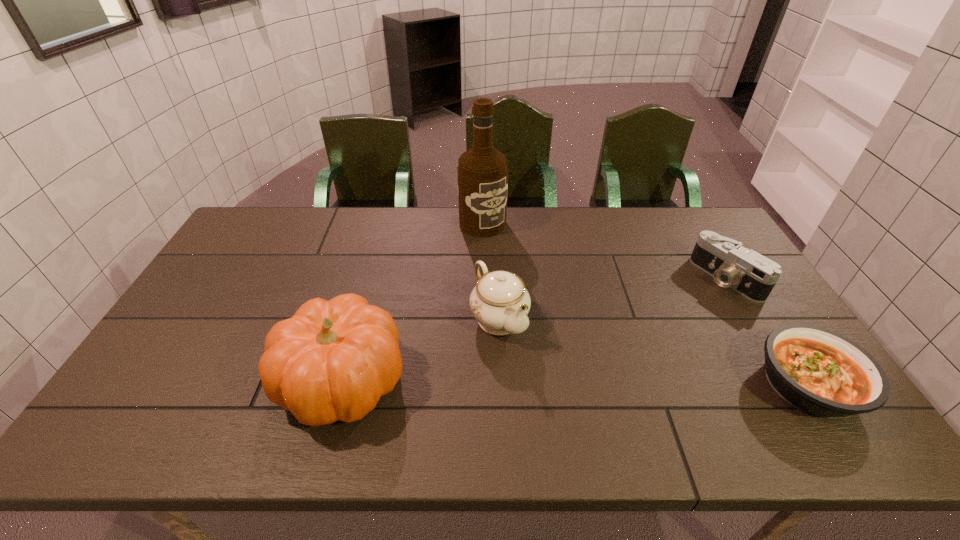
This screenshot has width=960, height=540. I want to click on vacant space on the desktop that is between the leftmost object and the shortest object and is positioned on the label of the tallest object, so click(x=628, y=383).

Locate an element on the screen. This screenshot has height=540, width=960. free space on the desktop that is between the second tallest object and the shortest object and is positioned on the lens of the camera is located at coordinates (561, 383).

Find the location of a particular element. The width and height of the screenshot is (960, 540). vacant spot on the desktop that is between the pumpkin and the shortest object and is positioned at the spout of the chinaware is located at coordinates (552, 383).